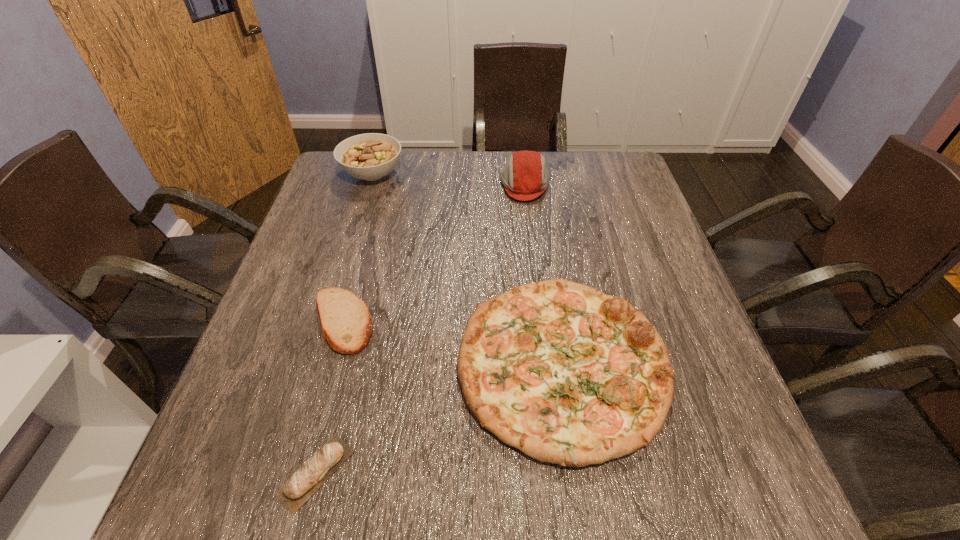
The width and height of the screenshot is (960, 540). I want to click on cap, so click(525, 177).

The height and width of the screenshot is (540, 960). Identify the location of stew. (371, 156).

This screenshot has height=540, width=960. I want to click on pizza, so (x=568, y=375).

Locate an element on the screen. This screenshot has width=960, height=540. the farther pita bread is located at coordinates (346, 323).

The height and width of the screenshot is (540, 960). I want to click on the nearer pita bread, so click(x=315, y=471).

Where is `blank space located 0.090m on the front-facing side of the cap`? The image size is (960, 540). blank space located 0.090m on the front-facing side of the cap is located at coordinates (469, 185).

Locate an element on the screen. free region located on the front-facing side of the cap is located at coordinates (385, 185).

Locate an element on the screen. Image resolution: width=960 pixels, height=540 pixels. free point located on the front-facing side of the cap is located at coordinates (408, 185).

In order to click on free space located 0.120m on the right of the stew in this screenshot , I will do `click(444, 174)`.

This screenshot has width=960, height=540. I want to click on free space located on the back of the third tallest object, so click(x=541, y=225).